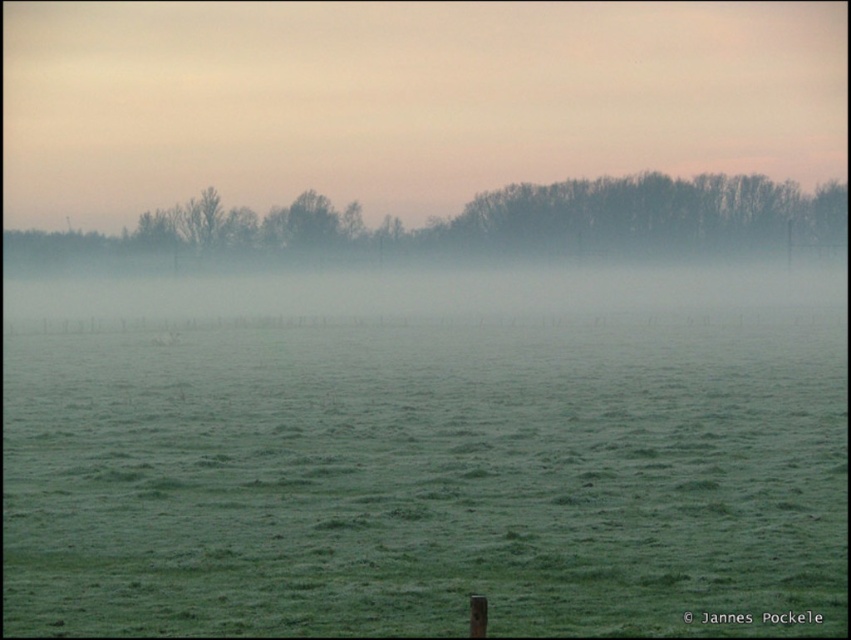
You are standing in the middle of the green grass at center and looking towards the silhouette bare trees at upper center. Are the trees above or below you?

The silhouette bare trees at upper center are above you because the green grass at center is located below them.

You are standing in the middle of the grassy field in the rural landscape. You see two points marked as point 1 at coordinates point (x=121, y=536) and point 2 at coordinates point (x=629, y=214). Which point is closer to you?

Point 1 at coordinates point (x=121, y=536) is closer to you because it is in front of point 2 at coordinates point (x=629, y=214).